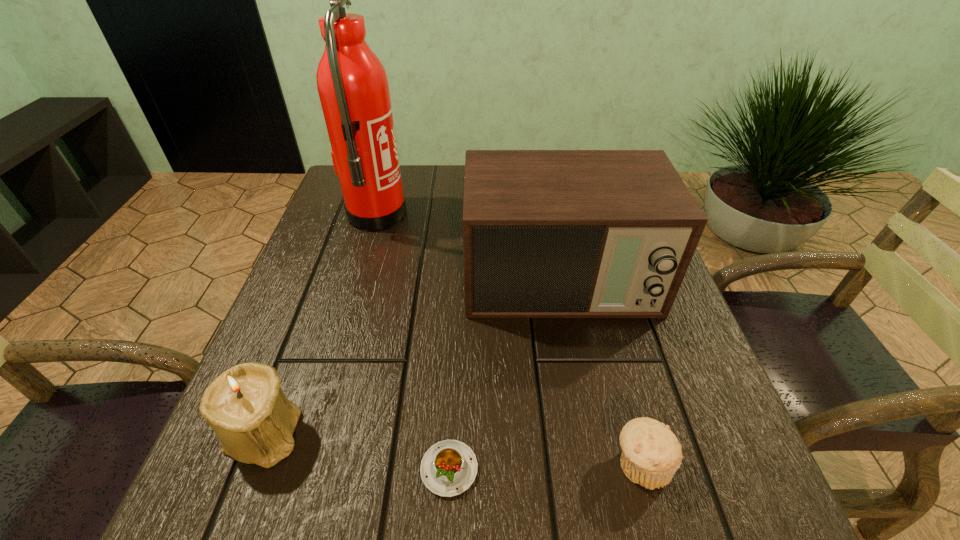
Find the location of a particular element. vacant area in the image that satisfies the following two spatial constraints: 1. on the front-facing side of the radio receiver; 2. on the left side of the muffin is located at coordinates (594, 463).

Locate an element on the screen. Image resolution: width=960 pixels, height=540 pixels. free region that satisfies the following two spatial constraints: 1. on the back side of the muffin; 2. on the right side of the shortest object is located at coordinates (449, 463).